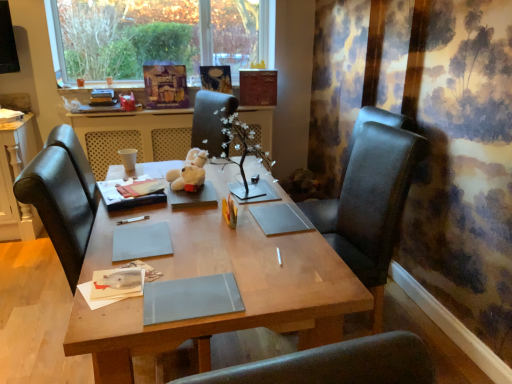
Where is `vacant space in front of white plush bear at center`? vacant space in front of white plush bear at center is located at coordinates (184, 202).